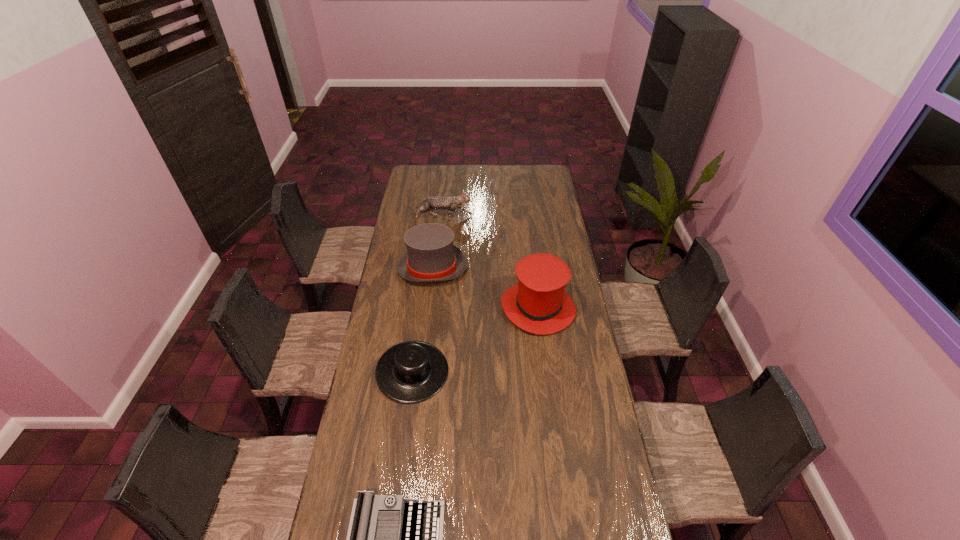
Identify the location of vacant space at the far edge of the desktop. The height and width of the screenshot is (540, 960). (510, 181).

In the image, there is a desktop. At what (x,y) coordinates should I click in order to perform the action: click on free space at the left edge. Please return your answer as a coordinate pair (x, y). Image resolution: width=960 pixels, height=540 pixels. Looking at the image, I should click on (383, 335).

The height and width of the screenshot is (540, 960). What are the coordinates of `free space at the right edge of the desktop` in the screenshot? It's located at (599, 453).

You are a GUI agent. You are given a task and a screenshot of the screen. Output one action in this format:
    pyautogui.click(x=<x>, y=<y>)
    Task: Click on the vacant space at the far left corner
    
    Given the screenshot: What is the action you would take?
    pyautogui.click(x=426, y=180)

The height and width of the screenshot is (540, 960). Find the location of `vacant space at the far right corner`. vacant space at the far right corner is located at coordinates (531, 184).

The image size is (960, 540). I want to click on empty space between the nearest dress hat and the third tallest object, so click(x=426, y=295).

Locate an element on the screen. This screenshot has height=540, width=960. free space between the fourth farthest object and the rightmost object is located at coordinates (475, 340).

Locate an element on the screen. This screenshot has width=960, height=540. free space between the second nearest object and the rightmost object is located at coordinates (475, 340).

Image resolution: width=960 pixels, height=540 pixels. Identify the location of vacant region between the rightmost dress hat and the fourth tallest object. (475, 340).

Image resolution: width=960 pixels, height=540 pixels. Find the location of `free space between the rightmost dress hat and the second nearest object`. free space between the rightmost dress hat and the second nearest object is located at coordinates (475, 340).